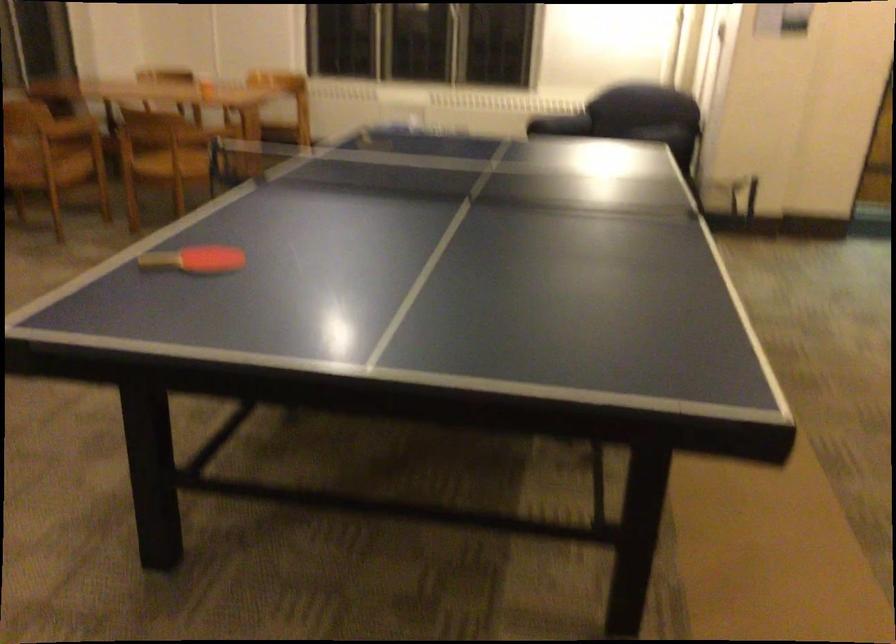
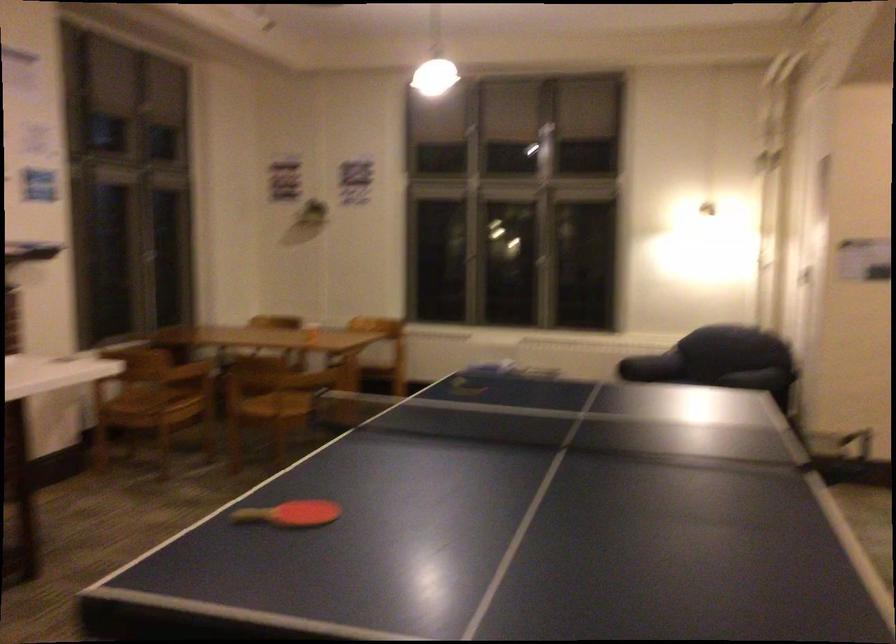
Question: How did the camera likely rotate?

Choices:
 (A) Left
 (B) Right
 (C) Up
 (D) Down

Answer: (C)